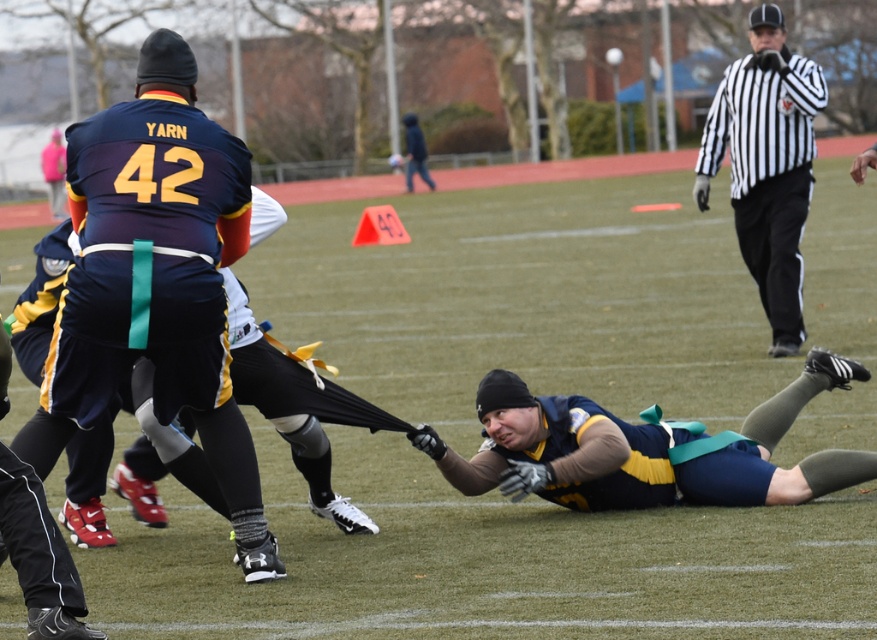
You are a referee observing the flag football game. You notice the black and white striped shirt at upper right and the dark blue jacket at upper center. Which of these two officials is closer to the action happening in the foreground?

The black and white striped shirt at upper right is in front of the dark blue jacket at upper center, meaning the black and white striped shirt at upper right is closer to the action happening in the foreground.

You are a referee observing the game. You notice the matte blue jersey at upper left and the dark blue jacket at upper center. Which one is positioned lower on the field?

The matte blue jersey at upper left is located below dark blue jacket at upper center, so the matte blue jersey at upper left is positioned lower on the field.